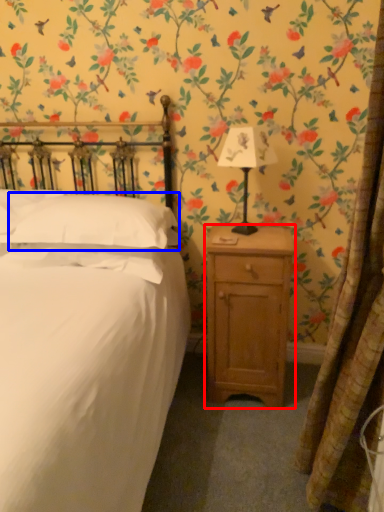
Question: Which object appears farthest to the camera in this image, nightstand (highlighted by a red box) or pillow (highlighted by a blue box)?

Choices:
 (A) nightstand
 (B) pillow

Answer: (A)